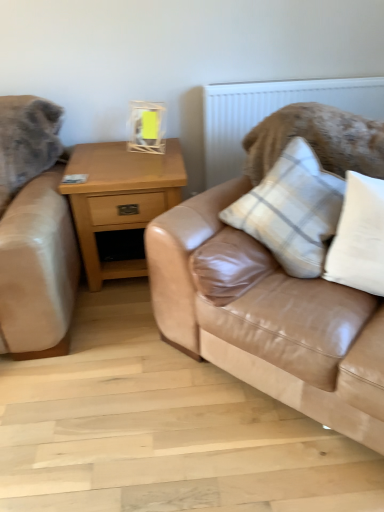
Find the location of a particular element. Image resolution: width=384 pixels, height=512 pixels. free space above light brown wood nightstand at center (from a real-world perspective) is located at coordinates 125,156.